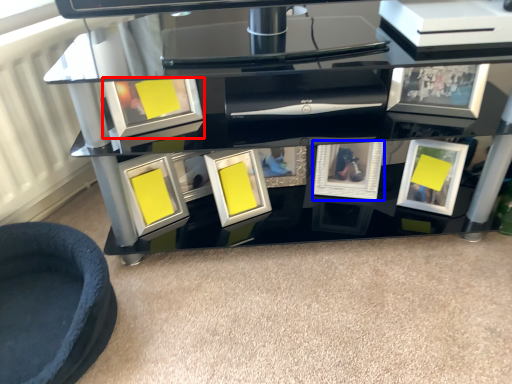
Question: Which object is closer to the camera taking this photo, picture frame (highlighted by a red box) or picture frame (highlighted by a blue box)?

Choices:
 (A) picture frame
 (B) picture frame

Answer: (A)